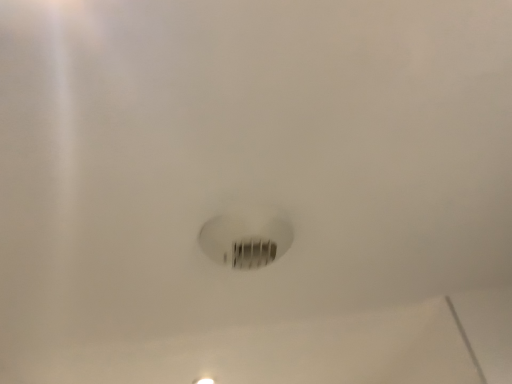
Question: Is white glossy light fixture at center to the left or to the right of white matte light bulb at center in the image?

Choices:
 (A) right
 (B) left

Answer: (B)

Question: From their relative heights in the image, would you say white glossy light fixture at center is taller or shorter than white matte light bulb at center?

Choices:
 (A) short
 (B) tall

Answer: (A)

Question: Looking at the image, does white glossy light fixture at center seem bigger or smaller compared to white matte light bulb at center?

Choices:
 (A) small
 (B) big

Answer: (A)

Question: Is white matte light bulb at center bigger or smaller than white glossy light fixture at center?

Choices:
 (A) small
 (B) big

Answer: (B)

Question: Is point click(x=281, y=248) positioned closer to the camera than point click(x=202, y=379)?

Choices:
 (A) farther
 (B) closer

Answer: (B)

Question: Is white matte light bulb at center in front of or behind white glossy light fixture at center in the image?

Choices:
 (A) front
 (B) behind

Answer: (A)

Question: From the image's perspective, is white matte light bulb at center located above or below white glossy light fixture at center?

Choices:
 (A) below
 (B) above

Answer: (B)